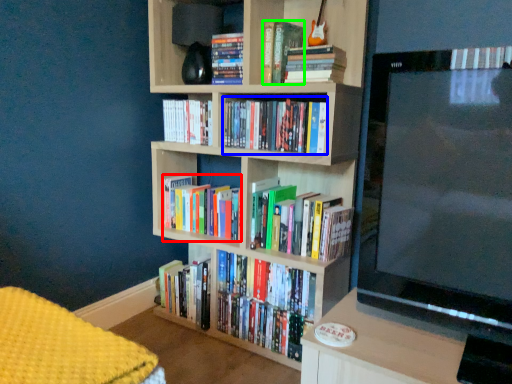
Question: Which object is positioned farthest from book (highlighted by a red box)? Select from book (highlighted by a blue box) and book (highlighted by a green box).

Choices:
 (A) book
 (B) book

Answer: (B)